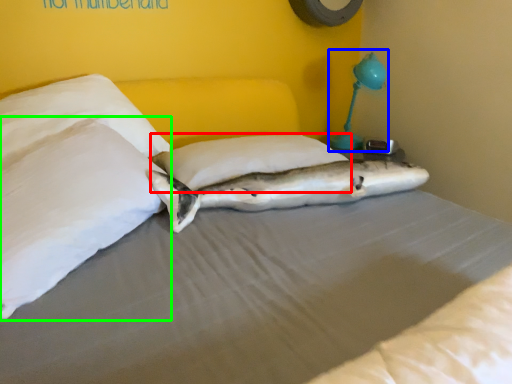
Question: Considering the real-world distances, which object is farthest from pillow (highlighted by a red box)? table lamp (highlighted by a blue box) or pillow (highlighted by a green box)?

Choices:
 (A) table lamp
 (B) pillow

Answer: (A)